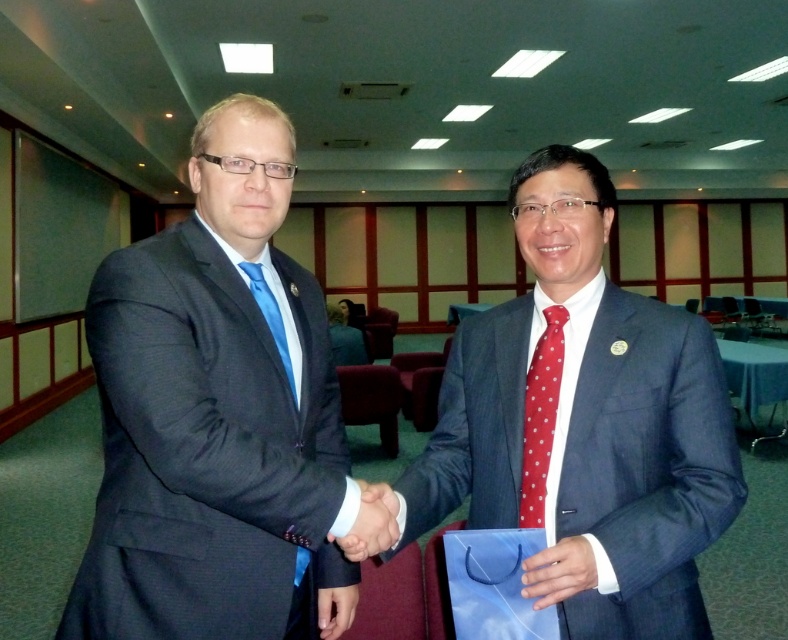
From the picture: Who is higher up, red dotted tie at center or matte blue suit at center?

red dotted tie at center is higher up.

Is point (536, 506) closer to camera compared to point (552, 592)?

No, (536, 506) is behind (552, 592).

Is point (532, 396) positioned in front of point (526, 588)?

No, it is behind (526, 588).

Where is `red dotted tie at center`? red dotted tie at center is located at coordinates (541, 416).

Can you confirm if matte black suit at left is smaller than matte blue tie at left?

Incorrect, matte black suit at left is not smaller in size than matte blue tie at left.

Who is lower down, matte black suit at left or matte blue tie at left?

matte black suit at left is lower down.

Describe the element at coordinates (216, 416) in the screenshot. I see `matte black suit at left` at that location.

Locate an element on the screen. The image size is (788, 640). matte black suit at left is located at coordinates (216, 416).

Can you confirm if matte blue suit at center is bigger than matte blue tie at left?

Incorrect, matte blue suit at center is not larger than matte blue tie at left.

Can you confirm if matte blue suit at center is positioned to the left of matte blue tie at left?

In fact, matte blue suit at center is to the right of matte blue tie at left.

The image size is (788, 640). In order to click on matte blue suit at center in this screenshot , I will do `click(559, 572)`.